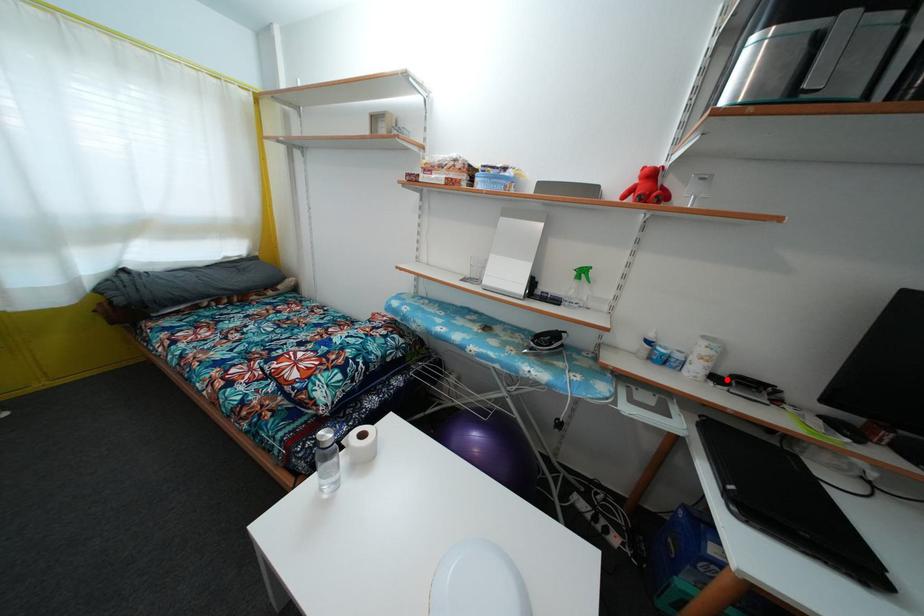
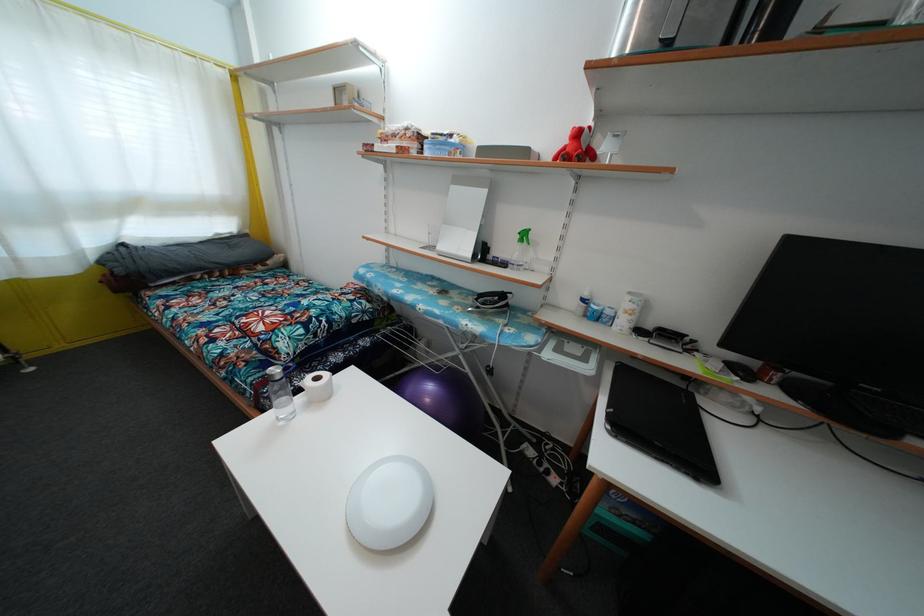
Find the pixel in the second image that matches the highlighted location in the first image.

(652, 334)